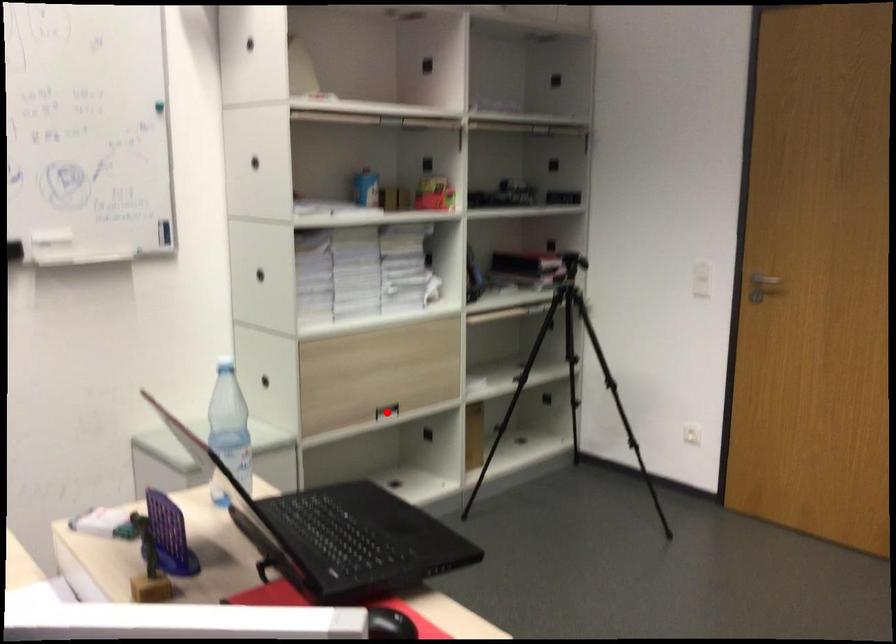
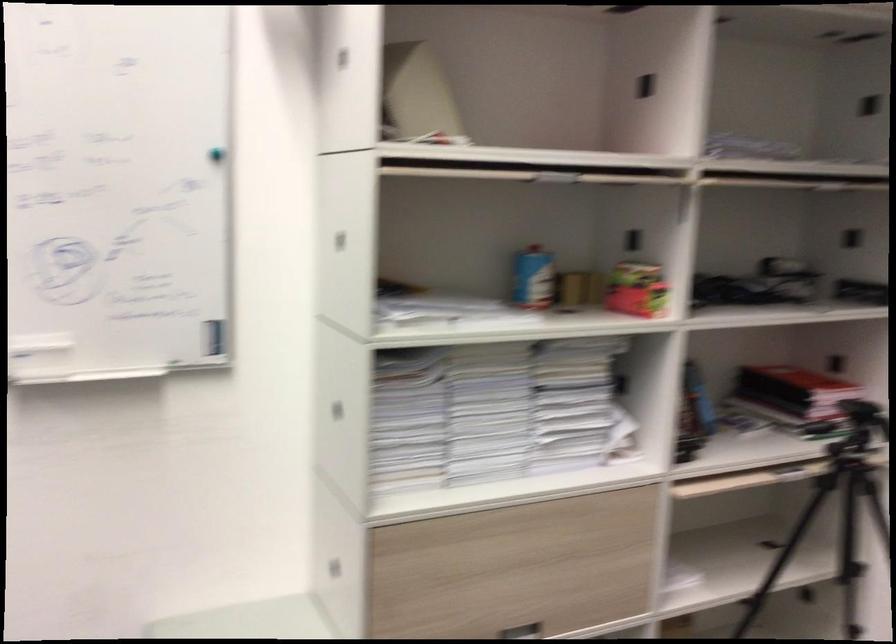
Question: I am providing you with two images of the same scene from different viewpoints. Given a red point in image1, look at the same physical point in image2. Is it:

Choices:
 (A) Closer to the viewpoint
 (B) Farther from the viewpoint

Answer: (A)